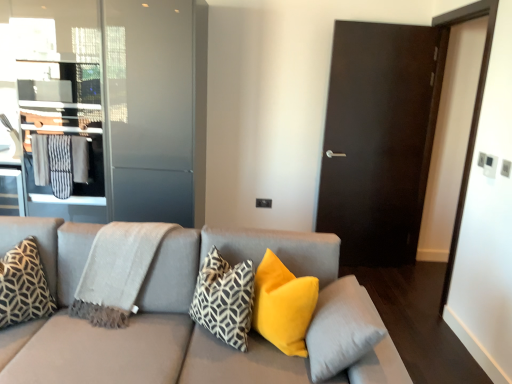
Describe the element at coordinates (224, 299) in the screenshot. I see `geometric-patterned fabric pillow at center, the 2th pillow when ordered from left to right` at that location.

Identify the location of transparent glass screen door at upper left. (153, 106).

The width and height of the screenshot is (512, 384). Describe the element at coordinates (342, 328) in the screenshot. I see `soft yellow pillow at center, which ranks as the 4th pillow in left-to-right order` at that location.

Identify the location of light gray woven blanket at left. The image size is (512, 384). (116, 272).

Image resolution: width=512 pixels, height=384 pixels. Describe the element at coordinates (176, 321) in the screenshot. I see `matte gray couch at center` at that location.

This screenshot has width=512, height=384. What are the coordinates of `metallic glass elevator at left` in the screenshot? It's located at (113, 104).

Does metallic glass elevator at left appear on the left side of light gray woven blanket at left?

Indeed, metallic glass elevator at left is positioned on the left side of light gray woven blanket at left.

Considering the relative positions of metallic glass elevator at left and light gray woven blanket at left in the image provided, is metallic glass elevator at left behind light gray woven blanket at left?

Yes, it is behind light gray woven blanket at left.

Locate an element on the screen. The width and height of the screenshot is (512, 384). elevator above the light gray woven blanket at left (from a real-world perspective) is located at coordinates (113, 104).

Considering the relative sizes of metallic glass elevator at left and light gray woven blanket at left in the image provided, is metallic glass elevator at left smaller than light gray woven blanket at left?

Incorrect, metallic glass elevator at left is not smaller in size than light gray woven blanket at left.

Could you tell me if soft yellow pillow at center, which ranks as the 4th pillow in left-to-right order, is turned towards light gray woven blanket at left?

Yes, soft yellow pillow at center, which ranks as the 4th pillow in left-to-right order, is turned towards light gray woven blanket at left.

From the image's perspective, who appears lower, soft yellow pillow at center, which appears as the first pillow when viewed from the right, or light gray woven blanket at left?

soft yellow pillow at center, which appears as the first pillow when viewed from the right.

Are soft yellow pillow at center, which ranks as the 4th pillow in left-to-right order, and light gray woven blanket at left located far from each other?

They are positioned close to each other.

From a real-world perspective, is geometric-patterned fabric pillow at left, which is counted as the 1th pillow, starting from the left, positioned under matte gray couch at center based on gravity?

No, from a real-world perspective, geometric-patterned fabric pillow at left, which is counted as the 1th pillow, starting from the left, is not under matte gray couch at center.

Is point (39, 283) closer or farther from the camera than point (60, 344)?

Point (39, 283) is positioned farther from the camera compared to point (60, 344).

In the scene shown: Does geometric-patterned fabric pillow at left, which is counted as the 1th pillow, starting from the left, have a lesser width compared to matte gray couch at center?

Indeed, geometric-patterned fabric pillow at left, which is counted as the 1th pillow, starting from the left, has a lesser width compared to matte gray couch at center.

Between geometric-patterned fabric pillow at left, which is the fourth pillow in right-to-left order, and matte gray couch at center, which one has more height?

matte gray couch at center.

From the image's perspective, would you say geometric-patterned fabric pillow at center, the 3th pillow in the right-to-left sequence, is positioned over soft yellow pillow at center, which appears as the first pillow when viewed from the right?

Yes, from the image's perspective, geometric-patterned fabric pillow at center, the 3th pillow in the right-to-left sequence, is on top of soft yellow pillow at center, which appears as the first pillow when viewed from the right.

Looking at this image, from a real-world perspective, which is physically below, geometric-patterned fabric pillow at center, the 2th pillow when ordered from left to right, or soft yellow pillow at center, which ranks as the 4th pillow in left-to-right order?

soft yellow pillow at center, which ranks as the 4th pillow in left-to-right order, from a real-world perspective.

Is there a large distance between geometric-patterned fabric pillow at center, the 2th pillow when ordered from left to right, and soft yellow pillow at center, which appears as the first pillow when viewed from the right?

No.

Is geometric-patterned fabric pillow at center, the 3th pillow in the right-to-left sequence, completely or partially outside of soft yellow pillow at center, which appears as the first pillow when viewed from the right?

geometric-patterned fabric pillow at center, the 3th pillow in the right-to-left sequence, lies outside soft yellow pillow at center, which appears as the first pillow when viewed from the right,'s area.

Is matte gray couch at center not near soft yellow pillow at center, which appears as the first pillow when viewed from the right?

No, matte gray couch at center is not far away from soft yellow pillow at center, which appears as the first pillow when viewed from the right.

From the picture: From the image's perspective, does matte gray couch at center appear higher than soft yellow pillow at center, which ranks as the 4th pillow in left-to-right order?

Incorrect, from the image's perspective, matte gray couch at center is lower than soft yellow pillow at center, which ranks as the 4th pillow in left-to-right order.

How distant is matte gray couch at center from soft yellow pillow at center, which appears as the first pillow when viewed from the right?

They are 13.80 inches apart.

From a real-world perspective, does matte gray couch at center sit lower than soft yellow pillow at center, which ranks as the 4th pillow in left-to-right order?

Yes.

How distant is matte gray couch at center from transparent glass screen door at upper left?

1.36 meters.

Does point (148, 284) lie behind point (192, 133)?

No, it is not.

Locate an element on the screen. The image size is (512, 384). studio couch below the transparent glass screen door at upper left (from the image's perspective) is located at coordinates (176, 321).

At what (x,y) coordinates should I click in order to perform the action: click on the 3rd pillow in front of the metallic glass elevator at left. Please return your answer as a coordinate pair (x, y). Looking at the image, I should click on (283, 305).

Does metallic glass elevator at left turn towards velvet yellow pillow at center, marked as the second pillow in a right-to-left arrangement?

No, metallic glass elevator at left is not oriented towards velvet yellow pillow at center, marked as the second pillow in a right-to-left arrangement.

Does metallic glass elevator at left appear on the right side of velvet yellow pillow at center, marked as the second pillow in a right-to-left arrangement?

No.

Would you say metallic glass elevator at left is inside or outside velvet yellow pillow at center, placed as the third pillow when sorted from left to right?

metallic glass elevator at left is outside velvet yellow pillow at center, placed as the third pillow when sorted from left to right.

At what (x,y) coordinates should I click in order to perform the action: click on blanket below the metallic glass elevator at left (from the image's perspective). Please return your answer as a coordinate pair (x, y). Looking at the image, I should click on (116, 272).

Image resolution: width=512 pixels, height=384 pixels. Find the location of `pillow that is the 4th object located in front of the light gray woven blanket at left`. pillow that is the 4th object located in front of the light gray woven blanket at left is located at coordinates (342, 328).

Looking at the image, which one is located closer to light gray woven blanket at left, transparent glass screen door at upper left or matte gray couch at center?

matte gray couch at center.

Which object lies nearer to the anchor point matte gray couch at center, velvet yellow pillow at center, marked as the second pillow in a right-to-left arrangement, or geometric-patterned fabric pillow at left, which is the fourth pillow in right-to-left order?

Among the two, velvet yellow pillow at center, marked as the second pillow in a right-to-left arrangement, is located nearer to matte gray couch at center.

Looking at the image, which one is located closer to soft yellow pillow at center, which ranks as the 4th pillow in left-to-right order, matte gray couch at center or geometric-patterned fabric pillow at center, the 3th pillow in the right-to-left sequence?

matte gray couch at center.

From the image, which object appears to be farther from soft yellow pillow at center, which ranks as the 4th pillow in left-to-right order, matte gray couch at center or light gray woven blanket at left?

The object further to soft yellow pillow at center, which ranks as the 4th pillow in left-to-right order, is light gray woven blanket at left.

Estimate the real-world distances between objects in this image. Which object is closer to transparent glass screen door at upper left, light gray woven blanket at left or geometric-patterned fabric pillow at center, the 3th pillow in the right-to-left sequence?

Based on the image, light gray woven blanket at left appears to be nearer to transparent glass screen door at upper left.

When comparing their distances from transparent glass screen door at upper left, does light gray woven blanket at left or geometric-patterned fabric pillow at left, which is the fourth pillow in right-to-left order, seem further?

Among the two, geometric-patterned fabric pillow at left, which is the fourth pillow in right-to-left order, is located further to transparent glass screen door at upper left.

From the image, which object appears to be farther from soft yellow pillow at center, which appears as the first pillow when viewed from the right, light gray woven blanket at left or velvet yellow pillow at center, marked as the second pillow in a right-to-left arrangement?

light gray woven blanket at left is further to soft yellow pillow at center, which appears as the first pillow when viewed from the right.

Considering their positions, is soft yellow pillow at center, which appears as the first pillow when viewed from the right, positioned closer to transparent glass screen door at upper left than velvet yellow pillow at center, placed as the third pillow when sorted from left to right?

velvet yellow pillow at center, placed as the third pillow when sorted from left to right, lies closer to transparent glass screen door at upper left than the other object.

In order to click on blanket between soft yellow pillow at center, which ranks as the 4th pillow in left-to-right order, and transparent glass screen door at upper left from front to back in this screenshot , I will do `click(116, 272)`.

Find the location of a particular element. The width and height of the screenshot is (512, 384). blanket between geometric-patterned fabric pillow at left, which is counted as the 1th pillow, starting from the left, and velvet yellow pillow at center, placed as the third pillow when sorted from left to right, from left to right is located at coordinates (116, 272).

The width and height of the screenshot is (512, 384). In order to click on studio couch between metallic glass elevator at left and soft yellow pillow at center, which appears as the first pillow when viewed from the right, from left to right in this screenshot , I will do `click(176, 321)`.

Locate an element on the screen. This screenshot has width=512, height=384. pillow between geometric-patterned fabric pillow at center, the 2th pillow when ordered from left to right, and soft yellow pillow at center, which appears as the first pillow when viewed from the right is located at coordinates (283, 305).